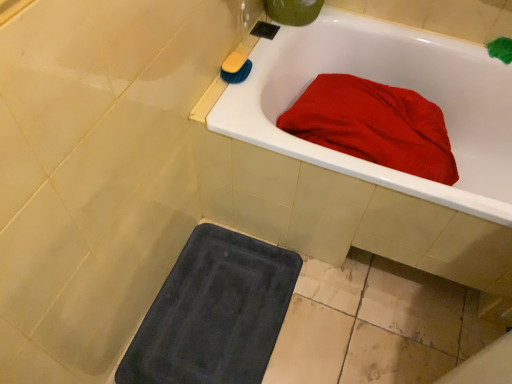
At what (x,y) coordinates should I click in order to perform the action: click on free space in front of yellow sponge at upper left. Please return your answer as a coordinate pair (x, y). This screenshot has height=384, width=512. Looking at the image, I should click on (231, 102).